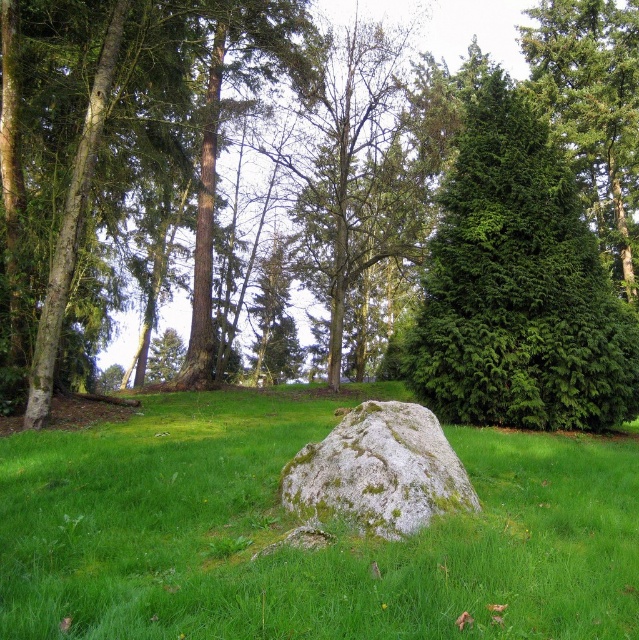
Question: Which point is closer to the camera?

Choices:
 (A) click(x=581, y=384)
 (B) click(x=512, y=358)

Answer: (A)

Question: Which of these objects is positioned closest to the gray mossy rock at center?

Choices:
 (A) green leafy tree at center
 (B) green textured evergreen tree at right
 (C) green textured evergreen tree at upper right
 (D) green grassy at center

Answer: (D)

Question: Considering the relative positions of green textured evergreen tree at right and gray mossy rock at center in the image provided, where is green textured evergreen tree at right located with respect to gray mossy rock at center?

Choices:
 (A) above
 (B) below

Answer: (A)

Question: Can you confirm if green textured evergreen tree at right is bigger than gray mossy rock at center?

Choices:
 (A) no
 (B) yes

Answer: (B)

Question: Which point is closer to the camera?

Choices:
 (A) (636, 307)
 (B) (70, 598)

Answer: (B)

Question: Can you confirm if green grassy at center is positioned to the left of green textured evergreen tree at upper right?

Choices:
 (A) yes
 (B) no

Answer: (A)